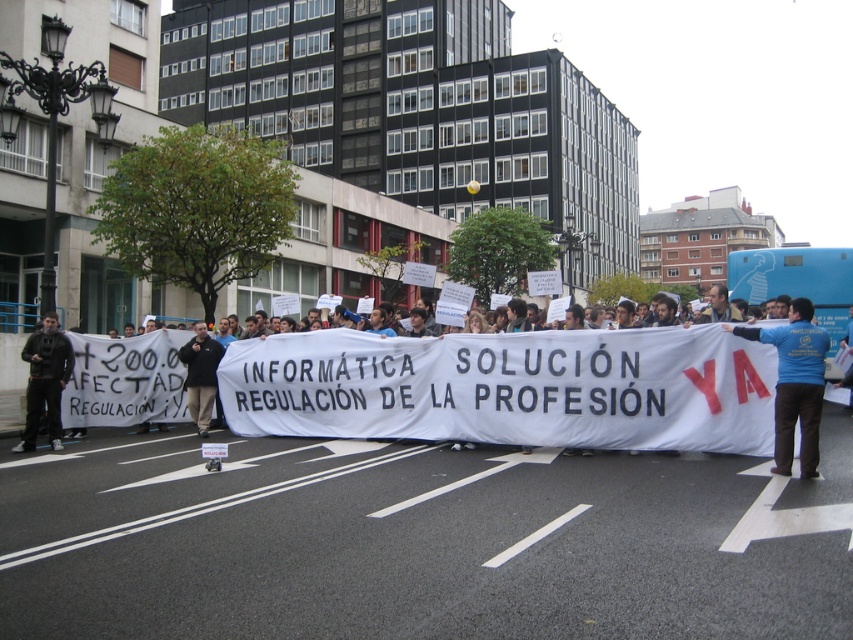
What are the coordinates of the blue shirt at center?

The blue shirt at center is located at point (509, 387).